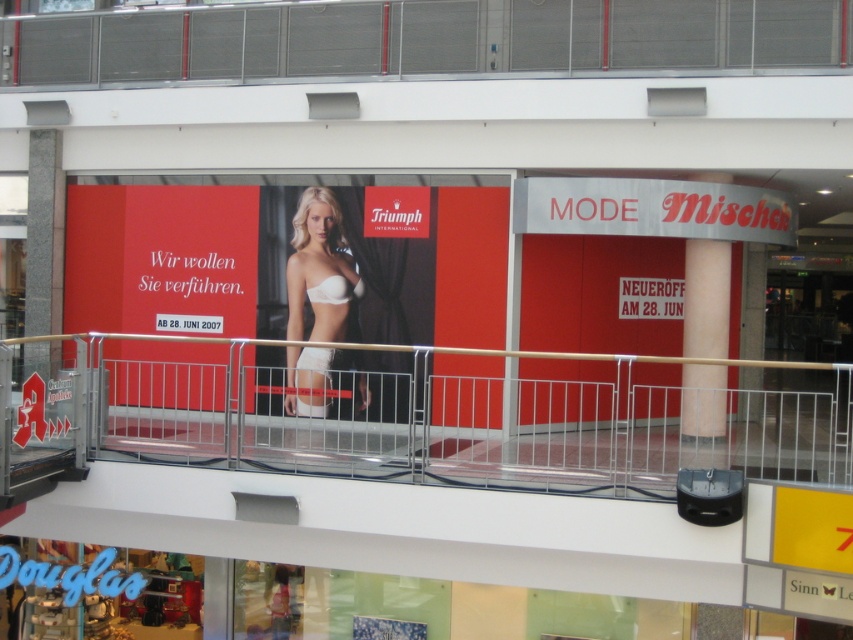
Question: Does white matte lingerie at center lie behind beige smooth column at center?

Choices:
 (A) no
 (B) yes

Answer: (B)

Question: Is matte red poster at upper center further to camera compared to beige smooth column at center?

Choices:
 (A) no
 (B) yes

Answer: (B)

Question: Among these points, which one is farthest from the camera?

Choices:
 (A) (109, 348)
 (B) (169, 268)
 (C) (712, 355)
 (D) (302, 320)

Answer: (A)

Question: In this image, where is metallic silver railing at center located relative to white matte lingerie at center?

Choices:
 (A) above
 (B) below

Answer: (B)

Question: Which point is farther to the camera?

Choices:
 (A) (207, 232)
 (B) (341, 280)
 (C) (413, 452)

Answer: (A)

Question: Which object is positioned closest to the beige smooth column at center?

Choices:
 (A) white matte lingerie at center
 (B) metallic silver railing at center

Answer: (B)